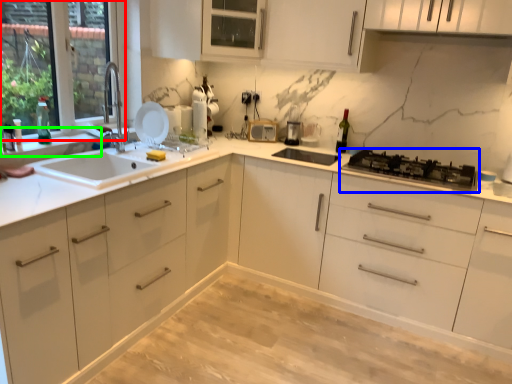
Question: Based on their relative distances, which object is farther from window (highlighted by a red box)? Choose from gas stove (highlighted by a blue box) and window sill (highlighted by a green box).

Choices:
 (A) gas stove
 (B) window sill

Answer: (A)